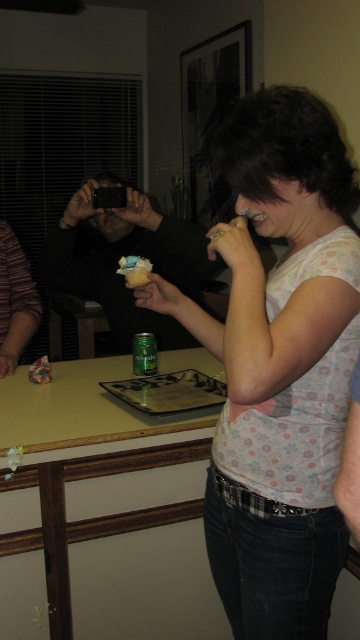
Question: Which of these objects is positioned farthest from the light brown laminate counter at center?

Choices:
 (A) matte white shirt at center
 (B) matte black phone at center
 (C) matte paper muffin at center

Answer: (B)

Question: From the image, what is the correct spatial relationship of light brown laminate counter at center in relation to matte paper muffin at center?

Choices:
 (A) right
 (B) left

Answer: (B)

Question: Based on their relative distances, which object is nearer to the matte paper muffin at center?

Choices:
 (A) light brown laminate counter at center
 (B) matte white shirt at center
 (C) matte black phone at center

Answer: (C)

Question: Is matte black phone at center positioned in front of matte paper muffin at center?

Choices:
 (A) yes
 (B) no

Answer: (B)

Question: Estimate the real-world distances between objects in this image. Which object is farther from the light brown laminate counter at center?

Choices:
 (A) matte white shirt at center
 (B) matte black phone at center
 (C) matte paper muffin at center

Answer: (B)

Question: Can you confirm if matte white shirt at center is thinner than light brown laminate counter at center?

Choices:
 (A) no
 (B) yes

Answer: (B)